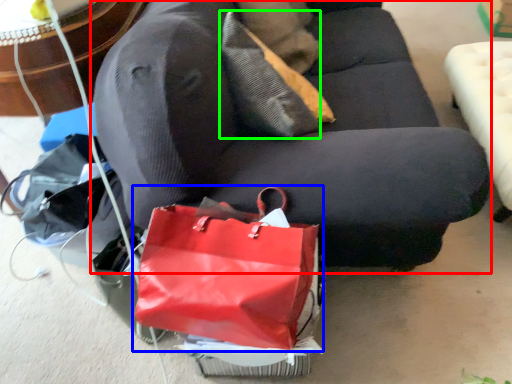
Question: Based on their relative distances, which object is farther from studio couch (highlighted by a red box)? Choose from handbag (highlighted by a blue box) and pillow (highlighted by a green box).

Choices:
 (A) handbag
 (B) pillow

Answer: (A)